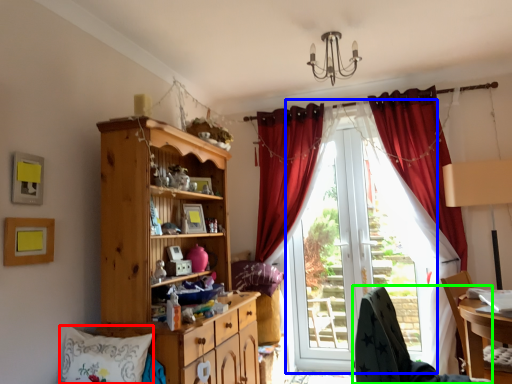
Question: Considering the real-world distances, which object is farthest from pillow (highlighted by a red box)? window screen (highlighted by a blue box) or chair (highlighted by a green box)?

Choices:
 (A) window screen
 (B) chair

Answer: (A)